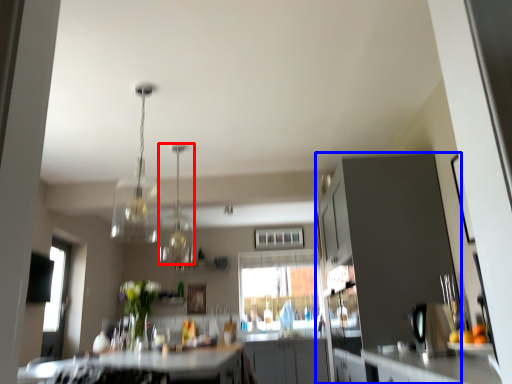
Question: Which of the following is the closest to the observer, light fixture (highlighted by a red box) or cabinetry (highlighted by a blue box)?

Choices:
 (A) light fixture
 (B) cabinetry

Answer: (B)